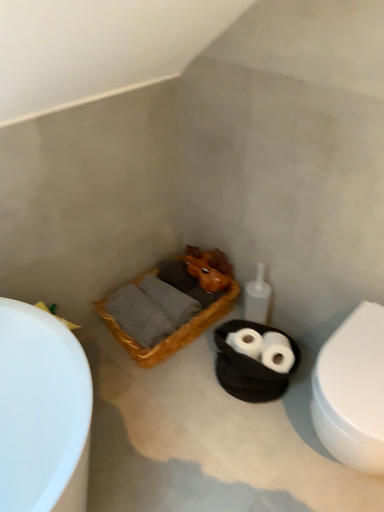
Question: In the image, is white matte toilet paper at center on the left side or the right side of white glossy bathtub at left?

Choices:
 (A) right
 (B) left

Answer: (A)

Question: Is white matte toilet paper at center wider or thinner than white glossy bathtub at left?

Choices:
 (A) wide
 (B) thin

Answer: (B)

Question: Which object is positioned farthest from the white glossy bathtub at left?

Choices:
 (A) woven wood basket at center
 (B) white matte toilet paper at center
 (C) black woven basket at center
 (D) white glossy toilet at right

Answer: (D)

Question: Estimate the real-world distances between objects in this image. Which object is closer to the white matte toilet paper at center?

Choices:
 (A) black woven basket at center
 (B) white glossy bathtub at left
 (C) white glossy toilet at right
 (D) woven wood basket at center

Answer: (A)